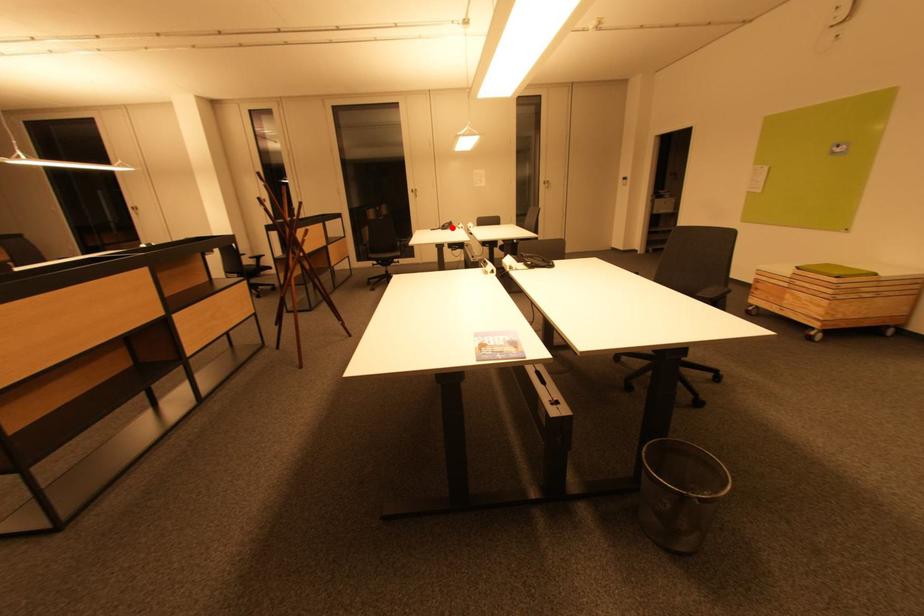
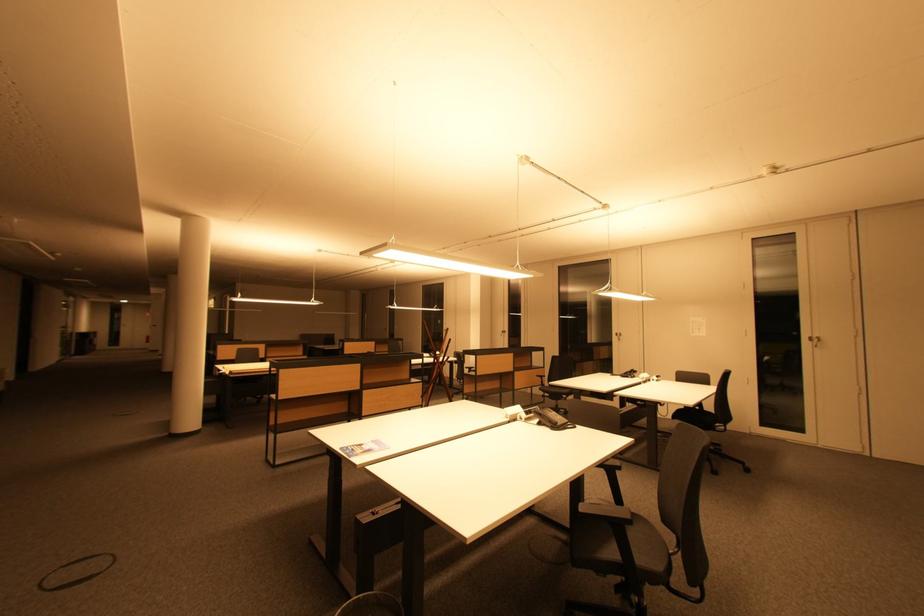
Question: I am providing you with two images of the same scene from different viewpoints. In image1, a red point is highlighted. Considering the same 3D point in image2, which of the following is correct?

Choices:
 (A) It is closer
 (B) It is farther

Answer: (B)